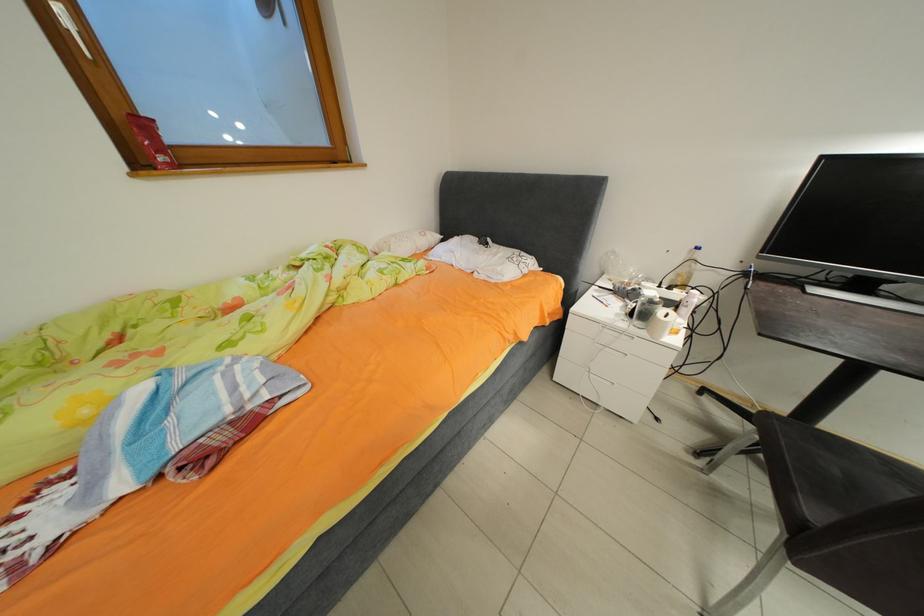
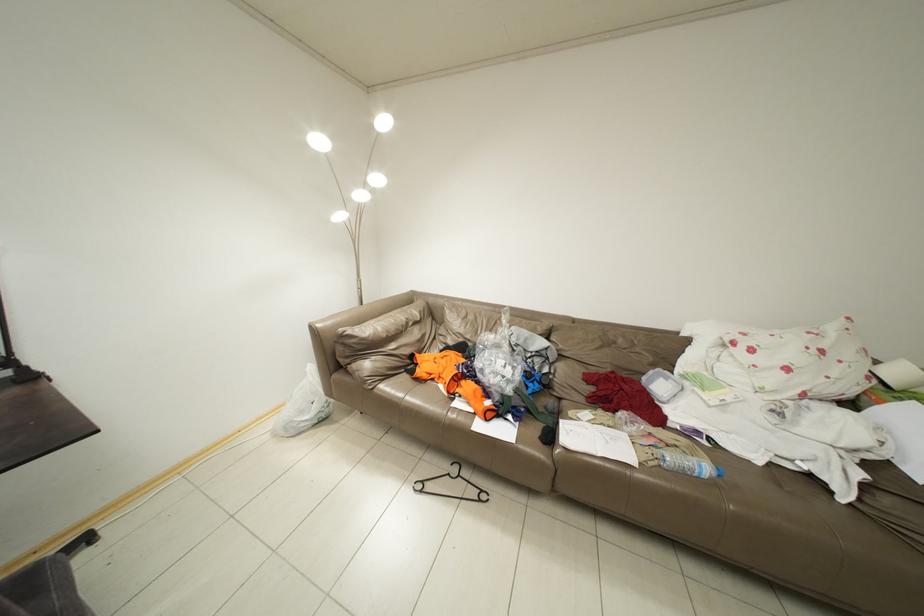
Based on the continuous images, in which direction is the camera rotating?

The rotation direction of the camera is right-down.